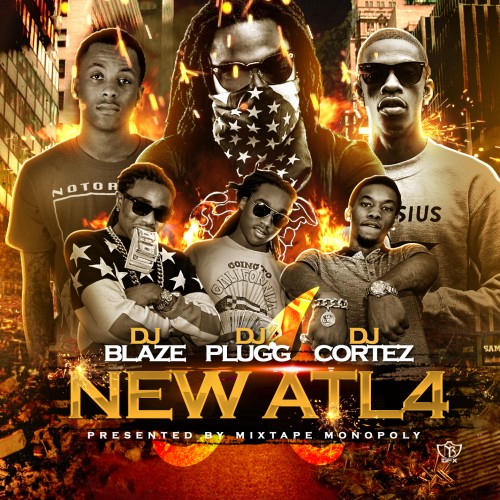
This screenshot has height=500, width=500. Find the location of `shades`. shades is located at coordinates (272, 70), (406, 69), (161, 214), (281, 220).